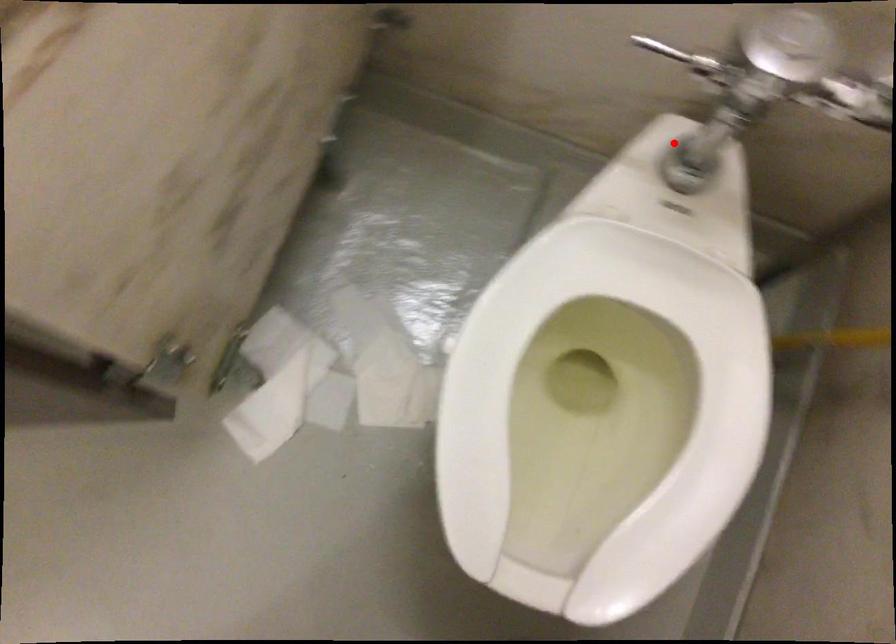
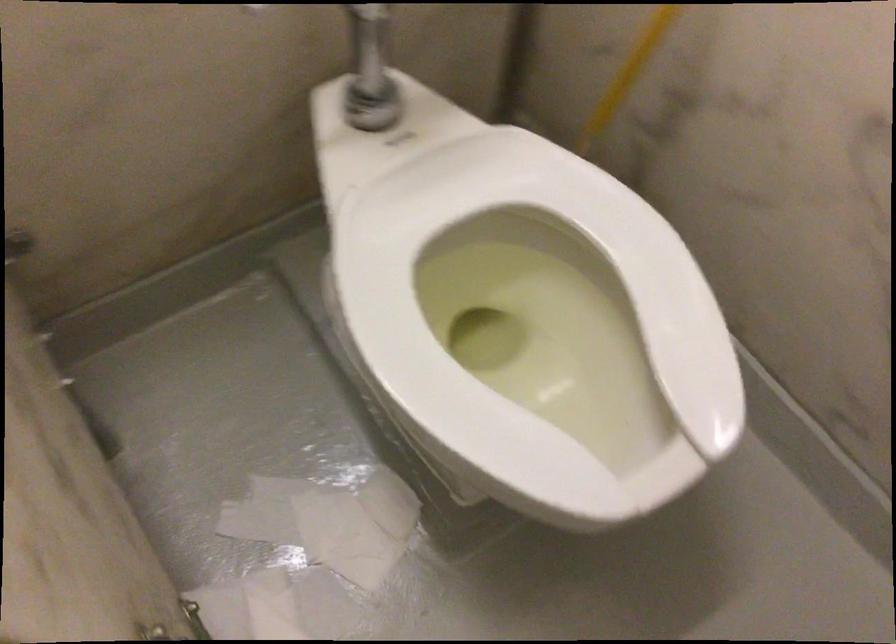
Find the pixel in the second image that matches the highlighted location in the first image.

(362, 96)